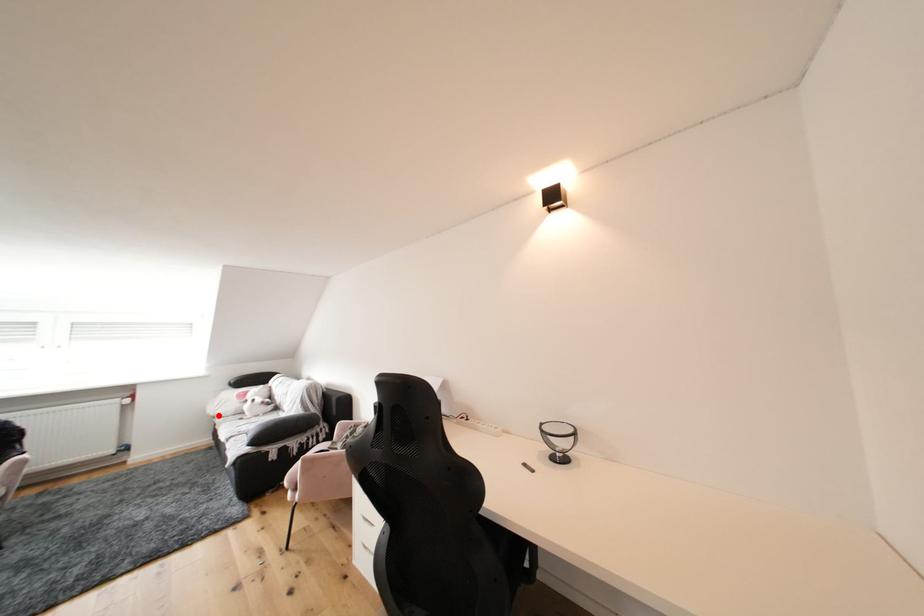
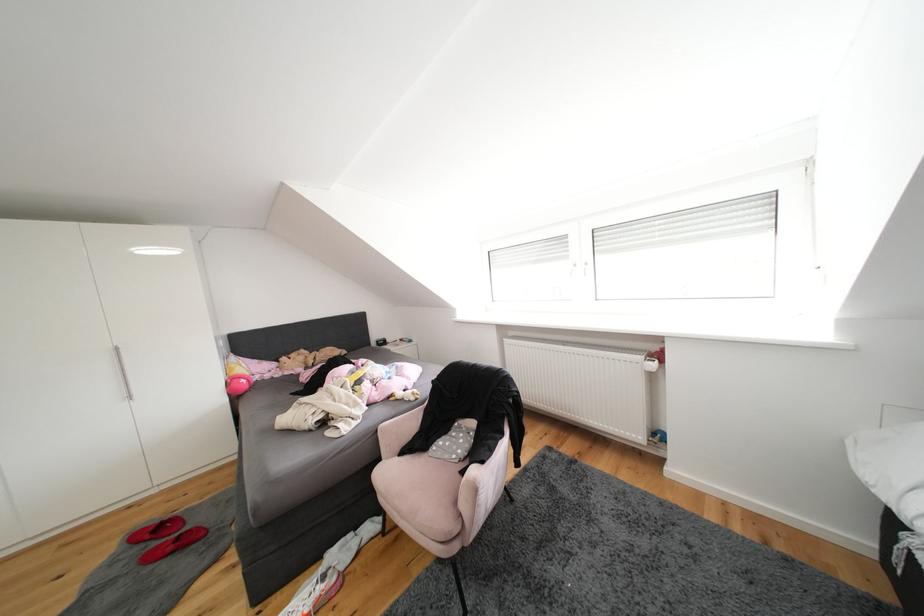
The point at the highlighted location is marked in the first image. Where is the corresponding point in the second image?

(874, 479)